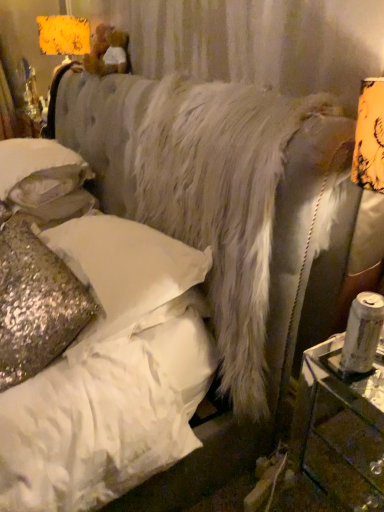
Question: Is white sequined pillow at upper left, which appears as the 3th pillow when ordered from the bottom, taller than clear glass table at right?

Choices:
 (A) no
 (B) yes

Answer: (A)

Question: Can you see white sequined pillow at upper left, the first pillow in the top-to-bottom sequence, touching clear glass table at right?

Choices:
 (A) yes
 (B) no

Answer: (B)

Question: Is white sequined pillow at upper left, the first pillow in the top-to-bottom sequence, facing away from clear glass table at right?

Choices:
 (A) yes
 (B) no

Answer: (B)

Question: Is white sequined pillow at upper left, which appears as the 3th pillow when ordered from the bottom, located outside clear glass table at right?

Choices:
 (A) yes
 (B) no

Answer: (A)

Question: Considering the relative sizes of white sequined pillow at upper left, the first pillow in the top-to-bottom sequence, and clear glass table at right in the image provided, is white sequined pillow at upper left, the first pillow in the top-to-bottom sequence, smaller than clear glass table at right?

Choices:
 (A) yes
 (B) no

Answer: (B)

Question: From their relative heights in the image, would you say sparkly gold pillow at lower left, marked as the 1th pillow in a bottom-to-top arrangement, is taller or shorter than glittery sequined pillow at lower left, which is the 2th pillow from bottom to top?

Choices:
 (A) short
 (B) tall

Answer: (B)

Question: Is sparkly gold pillow at lower left, which appears as the 3th pillow when viewed from the top, to the left or to the right of glittery sequined pillow at lower left, marked as the 2th pillow in a top-to-bottom arrangement, in the image?

Choices:
 (A) right
 (B) left

Answer: (B)

Question: Is sparkly gold pillow at lower left, marked as the 1th pillow in a bottom-to-top arrangement, wider or thinner than glittery sequined pillow at lower left, which is the 2th pillow from bottom to top?

Choices:
 (A) wide
 (B) thin

Answer: (B)

Question: From the image's perspective, is sparkly gold pillow at lower left, which appears as the 3th pillow when viewed from the top, above or below glittery sequined pillow at lower left, marked as the 2th pillow in a top-to-bottom arrangement?

Choices:
 (A) above
 (B) below

Answer: (B)

Question: In terms of width, does sparkly gold pillow at lower left, marked as the 1th pillow in a bottom-to-top arrangement, look wider or thinner when compared to white sequined pillow at upper left, the first pillow in the top-to-bottom sequence?

Choices:
 (A) thin
 (B) wide

Answer: (A)

Question: From a real-world perspective, is sparkly gold pillow at lower left, which appears as the 3th pillow when viewed from the top, above or below white sequined pillow at upper left, the first pillow in the top-to-bottom sequence?

Choices:
 (A) above
 (B) below

Answer: (B)

Question: Considering the positions of sparkly gold pillow at lower left, marked as the 1th pillow in a bottom-to-top arrangement, and white sequined pillow at upper left, the first pillow in the top-to-bottom sequence, in the image, is sparkly gold pillow at lower left, marked as the 1th pillow in a bottom-to-top arrangement, taller or shorter than white sequined pillow at upper left, the first pillow in the top-to-bottom sequence,?

Choices:
 (A) tall
 (B) short

Answer: (A)

Question: Is sparkly gold pillow at lower left, marked as the 1th pillow in a bottom-to-top arrangement, to the left or to the right of white sequined pillow at upper left, the first pillow in the top-to-bottom sequence, in the image?

Choices:
 (A) right
 (B) left

Answer: (A)

Question: Is clear glass table at right taller or shorter than sparkly gold pillow at lower left, marked as the 1th pillow in a bottom-to-top arrangement?

Choices:
 (A) short
 (B) tall

Answer: (B)

Question: Is clear glass table at right in front of or behind sparkly gold pillow at lower left, which appears as the 3th pillow when viewed from the top, in the image?

Choices:
 (A) behind
 (B) front

Answer: (B)